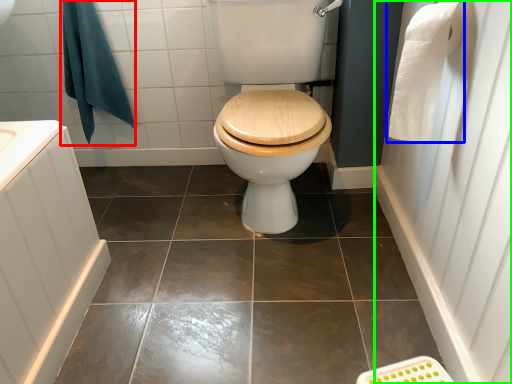
Question: Based on their relative distances, which object is farther from bath towel (highlighted by a red box)? Choose from toilet paper (highlighted by a blue box) and side (highlighted by a green box).

Choices:
 (A) toilet paper
 (B) side

Answer: (B)